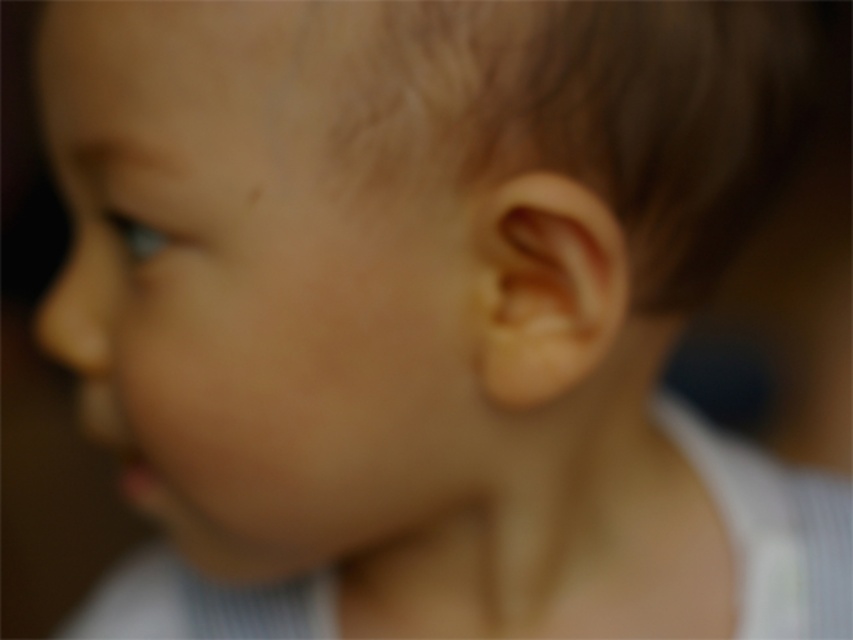
Question: Does smooth skin face at center have a larger size compared to brown fuzzy hair at upper right?

Choices:
 (A) no
 (B) yes

Answer: (B)

Question: Among these points, which one is nearest to the camera?

Choices:
 (A) (622, 49)
 (B) (320, 362)

Answer: (A)

Question: Does smooth skin face at center appear on the right side of brown fuzzy hair at upper right?

Choices:
 (A) yes
 (B) no

Answer: (B)

Question: Is smooth skin face at center further to camera compared to brown fuzzy hair at upper right?

Choices:
 (A) yes
 (B) no

Answer: (B)

Question: Which point is closer to the camera?

Choices:
 (A) smooth skin face at center
 (B) brown fuzzy hair at upper right

Answer: (A)